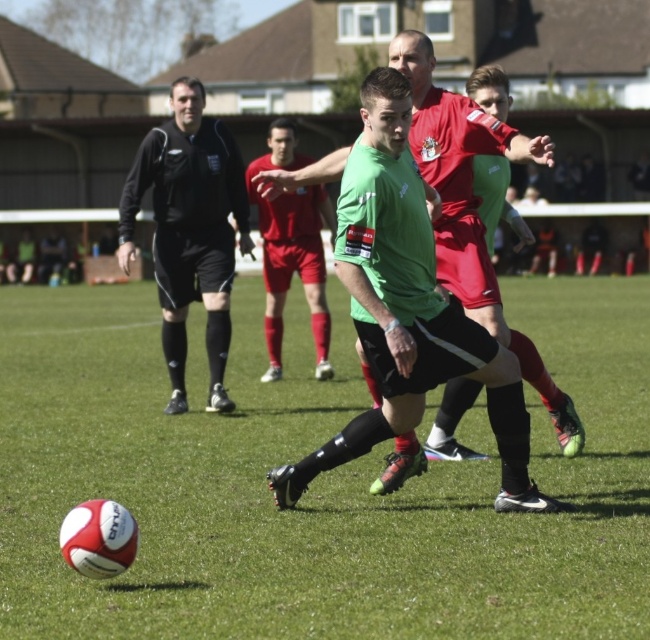
Between point (410, 432) and point (179, 179), which one is positioned in front?

Point (410, 432) is in front.

Is point (463, 333) less distant than point (192, 154)?

Yes, it is in front of point (192, 154).

Is point (422, 387) farther from viewer compared to point (133, 204)?

No, it is in front of (133, 204).

Identify the location of green matte jersey at center. The height and width of the screenshot is (640, 650). (408, 308).

Which of these two, green matte jersey at center or red matte soccer player at center, stands shorter?

Standing shorter between the two is red matte soccer player at center.

Is point (450, 349) less distant than point (266, 348)?

Yes, point (450, 349) is closer to viewer.

What do you see at coordinates (408, 308) in the screenshot? The height and width of the screenshot is (640, 650). I see `green matte jersey at center` at bounding box center [408, 308].

Locate an element on the screen. green matte jersey at center is located at coordinates (408, 308).

Which is below, white textured ball at lower left or green matte jersey at center?

Positioned lower is white textured ball at lower left.

Can you confirm if white textured ball at lower left is taller than green matte jersey at center?

No, white textured ball at lower left is not taller than green matte jersey at center.

Is point (224, 435) more distant than point (387, 145)?

Yes.

Find the location of a particular element. The width and height of the screenshot is (650, 640). white textured ball at lower left is located at coordinates pos(313,483).